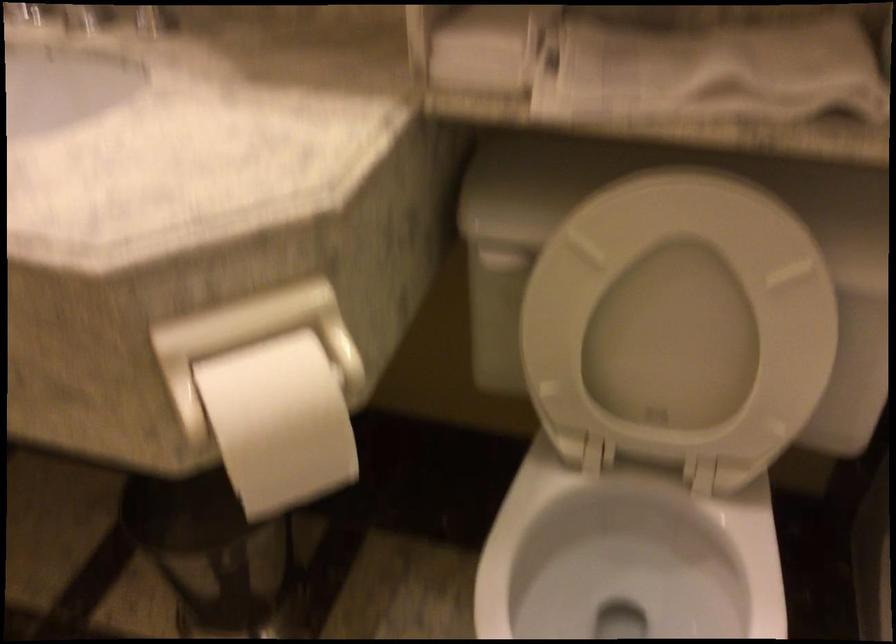
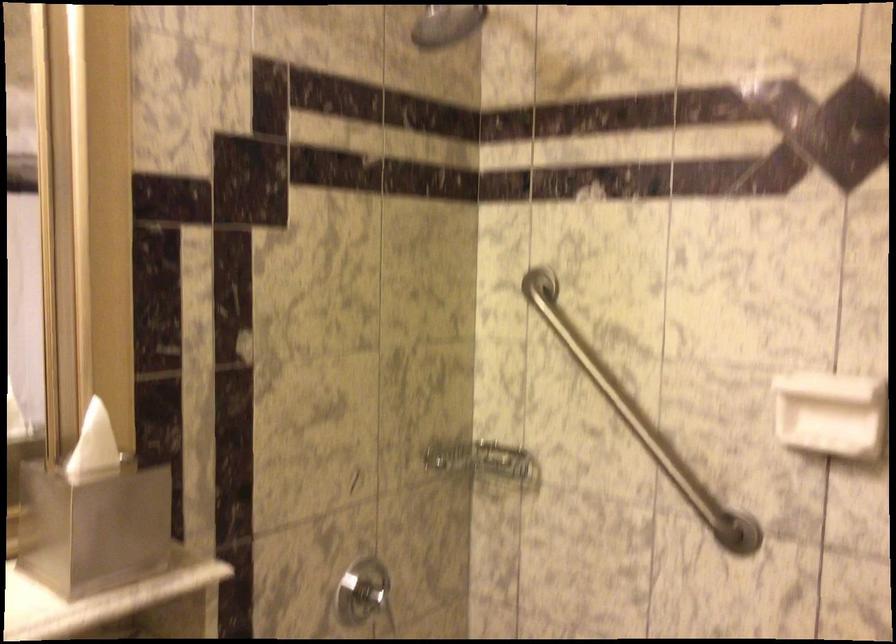
Question: How did the camera likely rotate?

Choices:
 (A) Left
 (B) Right
 (C) Up
 (D) Down

Answer: (B)